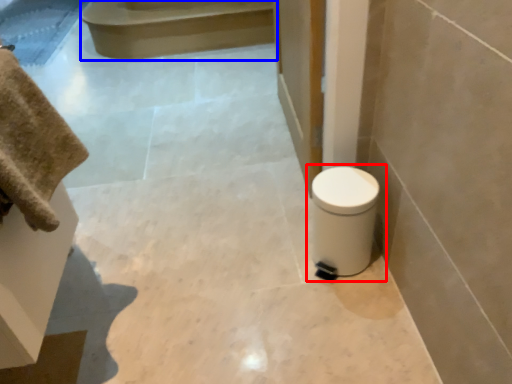
Question: Among these objects, which one is nearest to the camera, toilet (highlighted by a red box) or stair (highlighted by a blue box)?

Choices:
 (A) toilet
 (B) stair

Answer: (A)